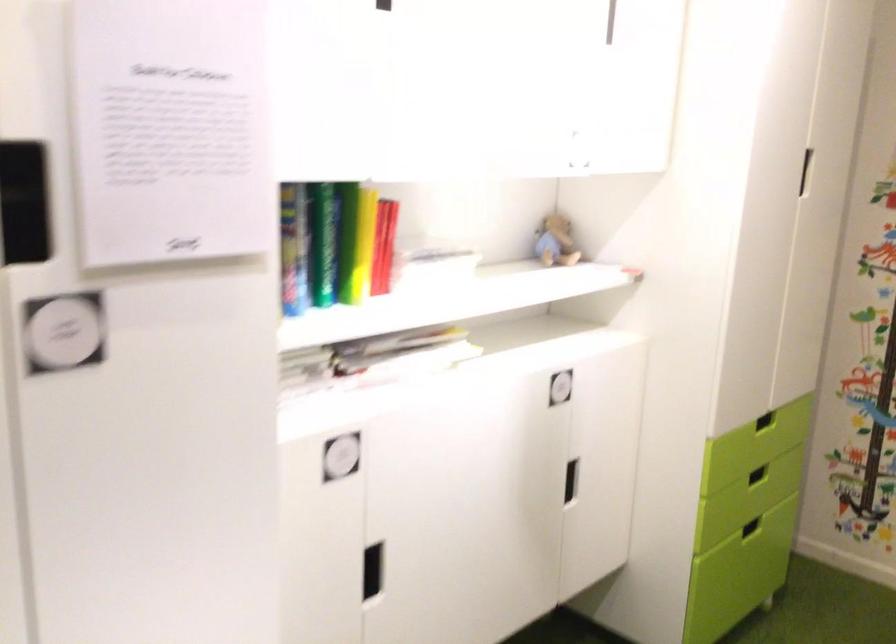
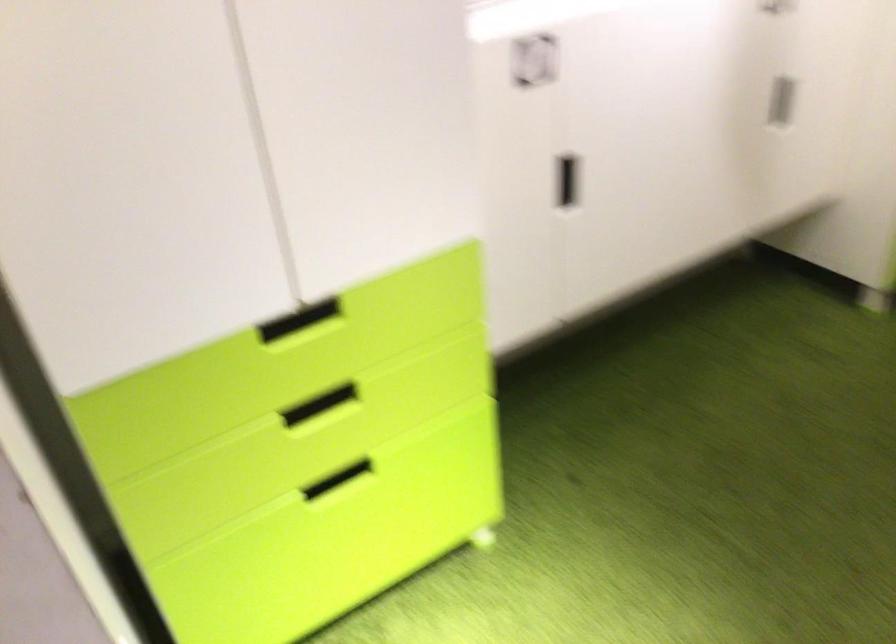
The images are taken continuously from a first-person perspective. In which direction is your viewpoint rotating?

The rotation direction of the camera is left-down.